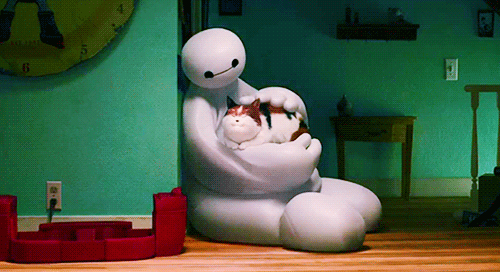
The image size is (500, 272). Identify the location of electrical outlet. pos(54,192).